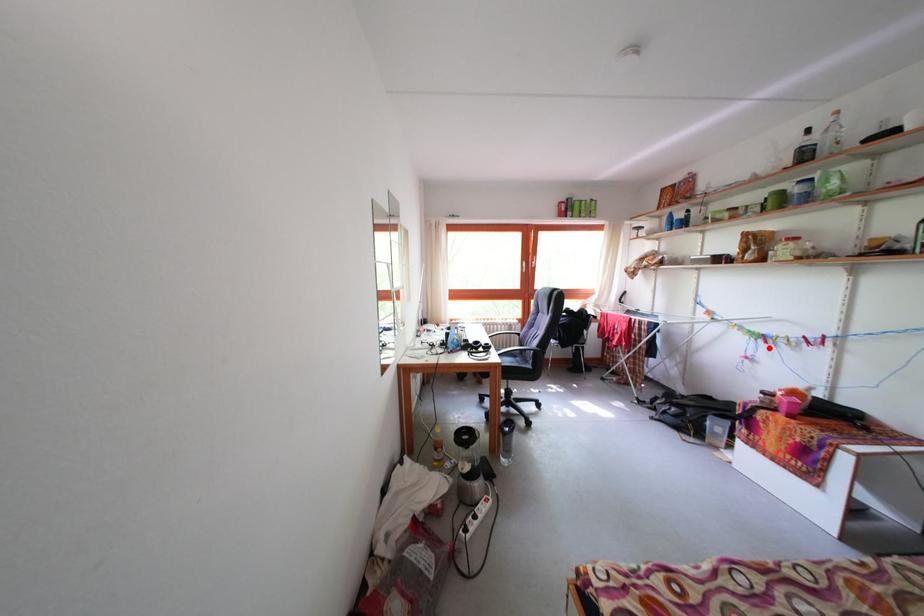
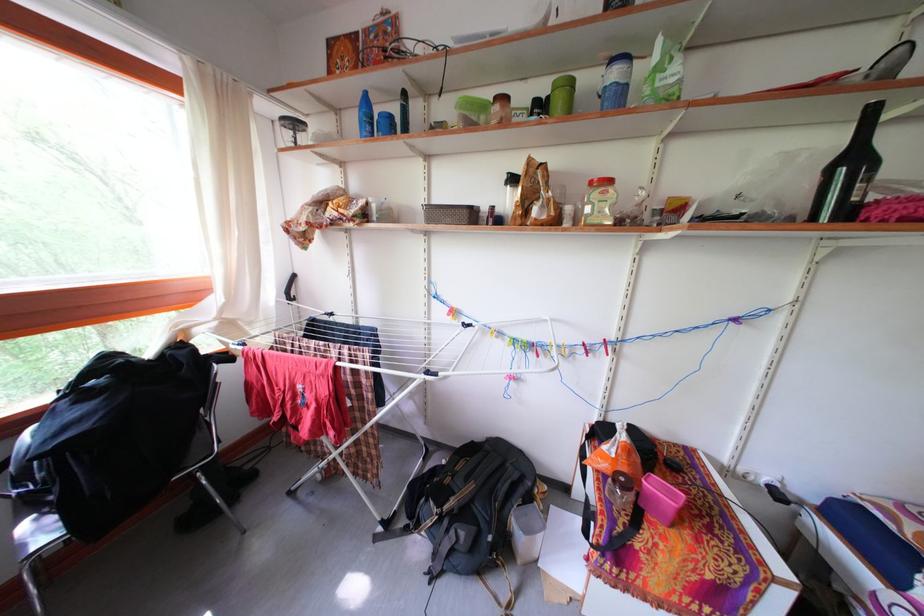
Find the pixel in the second image that matches the highlighted location in the first image.

(540, 361)